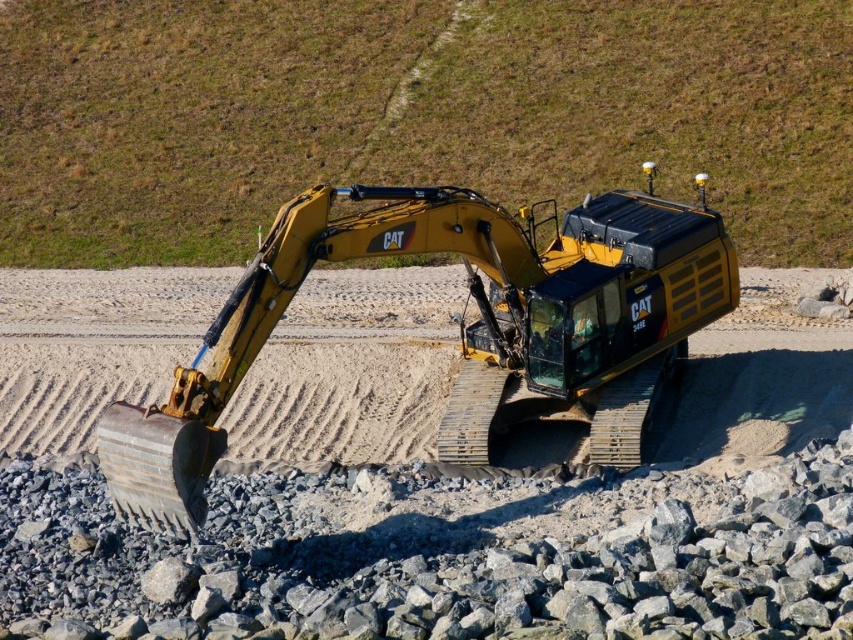
Is yellow rubber tracks at center closer to the viewer compared to yellow metallic tractor at center?

No.

Is yellow rubber tracks at center wider than yellow metallic tractor at center?

Yes, yellow rubber tracks at center is wider than yellow metallic tractor at center.

Between point (148, 208) and point (556, 246), which one is positioned behind?

The point (148, 208) is behind.

Where is `yellow rubber tracks at center`? The image size is (853, 640). yellow rubber tracks at center is located at coordinates (412, 115).

Measure the distance from yellow rubber tracks at center to gray gravel at lower center.

77.20 feet

Is point (573, 109) positioned before point (154, 628)?

No.

Between point (685, 144) and point (692, 563), which one is positioned behind?

Positioned behind is point (685, 144).

You are a GUI agent. You are given a task and a screenshot of the screen. Output one action in this format:
    pyautogui.click(x=<x>, y=<y>)
    Task: Click on the yellow rubber tracks at center
    
    Given the screenshot: What is the action you would take?
    pyautogui.click(x=412, y=115)

Who is lower down, gray gravel at lower center or yellow metallic tractor at center?

gray gravel at lower center is lower down.

Can you confirm if gray gravel at lower center is wider than yellow metallic tractor at center?

Yes, gray gravel at lower center is wider than yellow metallic tractor at center.

Who is more forward, (697,509) or (506,268)?

Point (697,509) is more forward.

Where is `gray gravel at lower center`? gray gravel at lower center is located at coordinates (436, 557).